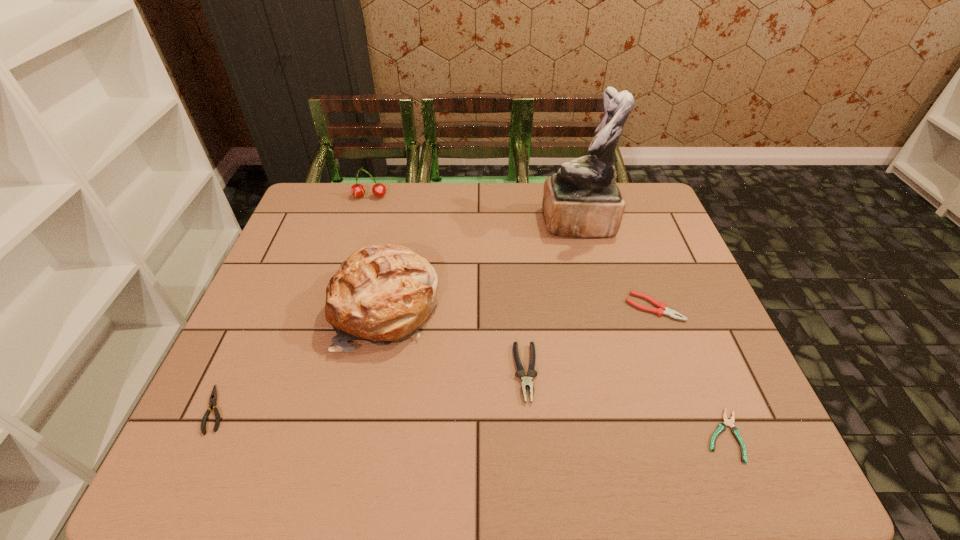
The image size is (960, 540). In order to click on free space located on the left of the shortest object in this screenshot , I will do `click(534, 435)`.

Locate an element on the screen. The image size is (960, 540). sculpture at the far edge is located at coordinates (582, 200).

At what (x,y) coordinates should I click in order to perform the action: click on cherry that is at the far edge. Please return your answer as a coordinate pair (x, y). This screenshot has width=960, height=540. Looking at the image, I should click on (357, 190).

You are a GUI agent. You are given a task and a screenshot of the screen. Output one action in this format:
    pyautogui.click(x=<x>, y=<y>)
    Task: Click on the cherry located in the left edge section of the desktop
    This screenshot has width=960, height=540.
    Given the screenshot: What is the action you would take?
    pyautogui.click(x=357, y=190)

Where is `pliers positioned at the left edge`? pliers positioned at the left edge is located at coordinates (213, 397).

Locate an element on the screen. object at the far left corner is located at coordinates (357, 190).

I want to click on object at the near left corner, so click(x=213, y=397).

Where is `object that is at the near right corner`? object that is at the near right corner is located at coordinates (722, 426).

This screenshot has width=960, height=540. What are the coordinates of `vacant space at the far edge` in the screenshot? It's located at (520, 195).

This screenshot has height=540, width=960. In order to click on vacant space at the near edge of the desktop in this screenshot , I will do `click(450, 457)`.